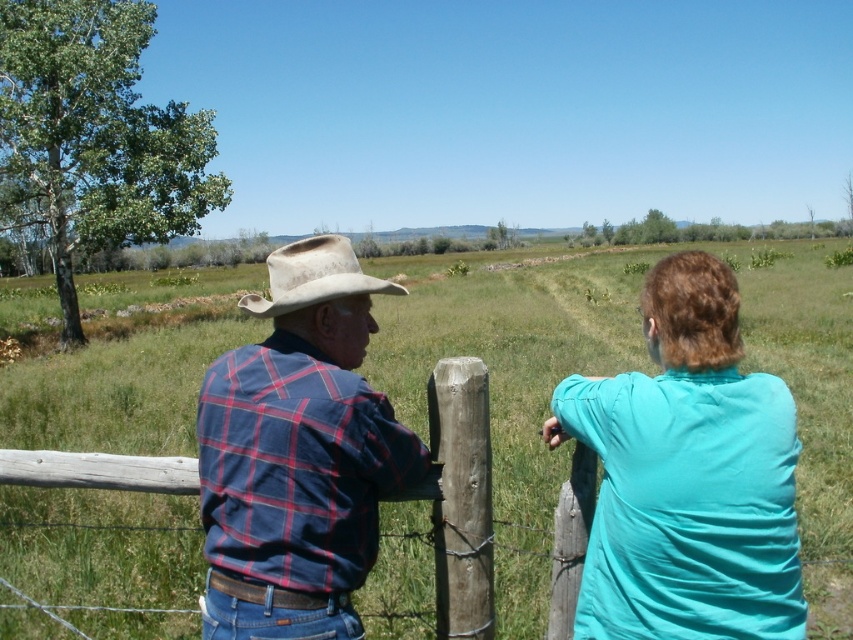
In the scene shown: Can you confirm if teal fabric shirt at right is positioned to the left of worn beige fabric cowboy hat at upper center?

Incorrect, teal fabric shirt at right is not on the left side of worn beige fabric cowboy hat at upper center.

The width and height of the screenshot is (853, 640). Find the location of `teal fabric shirt at right`. teal fabric shirt at right is located at coordinates (688, 476).

Between point (303, 268) and point (296, 300), which one is positioned in front?

Point (296, 300) is more forward.

Locate an element on the screen. plaid cotton shirt at center is located at coordinates click(299, 454).

Can you confirm if plaid fabric shirt at left is smaller than teal fabric shirt at right?

No.

Can you confirm if plaid fabric shirt at left is positioned to the left of teal fabric shirt at right?

No, plaid fabric shirt at left is not to the left of teal fabric shirt at right.

At what (x,y) coordinates should I click in order to perform the action: click on plaid fabric shirt at left. Please return your answer as a coordinate pair (x, y). This screenshot has height=640, width=853. Looking at the image, I should click on (688, 476).